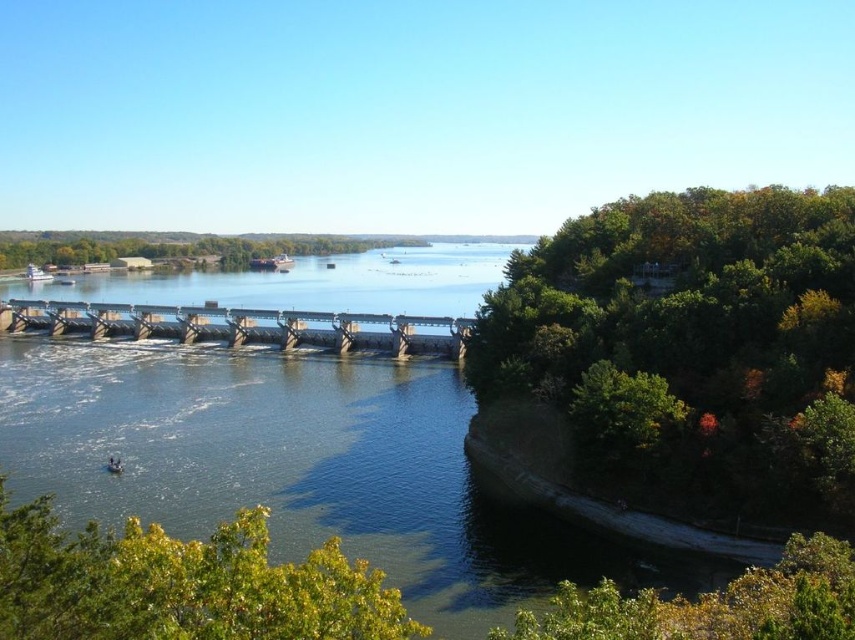
Question: Which point is farther to the camera?

Choices:
 (A) (738, 604)
 (B) (714, 336)
 (C) (270, 259)

Answer: (C)

Question: Which object is farther from the camera taking this photo?

Choices:
 (A) green leafy trees at right
 (B) green leafy tree at lower left

Answer: (A)

Question: Which of the following is the farthest from the observer?

Choices:
 (A) [x=27, y=324]
 (B) [x=287, y=264]

Answer: (B)

Question: Does greenish concrete dam at center appear under green leafy tree at lower right?

Choices:
 (A) yes
 (B) no

Answer: (B)

Question: Can you confirm if green leafy tree at lower left is positioned above concrete dam at center?

Choices:
 (A) no
 (B) yes

Answer: (A)

Question: Does green leafy tree at lower right appear under white plastic boat at left?

Choices:
 (A) no
 (B) yes

Answer: (B)